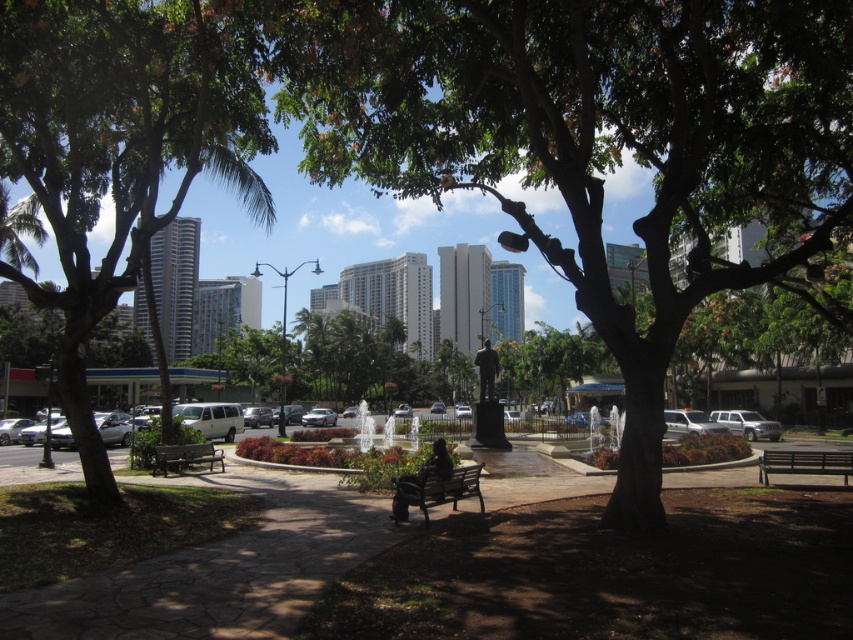
Question: Is dark brown textured tree at center further to camera compared to dark brown wooden bench at lower left?

Choices:
 (A) yes
 (B) no

Answer: (B)

Question: Which object is closer to the camera taking this photo?

Choices:
 (A) wooden park bench at lower right
 (B) dark brown wooden bench at lower left
 (C) green leafy tree at left

Answer: (C)

Question: Can you confirm if dark brown textured tree at center is smaller than wooden bench at center?

Choices:
 (A) yes
 (B) no

Answer: (B)

Question: Which of these objects is positioned closest to the dark brown wooden bench at lower left?

Choices:
 (A) wooden bench at center
 (B) wooden park bench at lower right
 (C) green leafy tree at left

Answer: (C)

Question: Estimate the real-world distances between objects in this image. Which object is farther from the wooden bench at center?

Choices:
 (A) dark brown wooden bench at lower left
 (B) wooden park bench at lower right
 (C) dark brown textured tree at center

Answer: (A)

Question: Does dark brown textured tree at center appear on the left side of wooden bench at center?

Choices:
 (A) yes
 (B) no

Answer: (B)